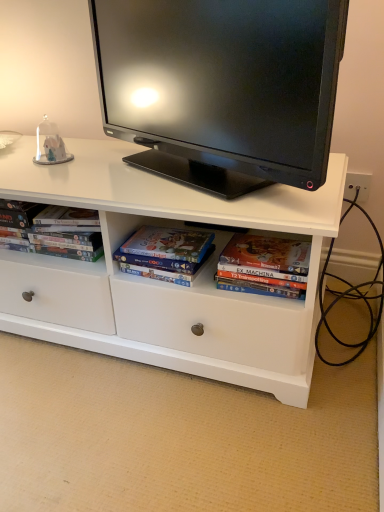
In order to click on matte black dvd case at left in this screenshot , I will do `click(51, 230)`.

The width and height of the screenshot is (384, 512). I want to click on black glossy tv at upper center, so click(x=222, y=88).

Locate an element on the screen. matte black dvd case at left is located at coordinates (51, 230).

From a real-world perspective, which object rests below the other?

matte cardboard book at center.

From the image's perspective, which one is positioned higher, matte black dvd case at left or matte cardboard book at center?

matte black dvd case at left is shown above in the image.

Which object is thinner, matte black dvd case at left or matte cardboard book at center?

Thinner between the two is matte black dvd case at left.

In the image, is matte black dvd case at left positioned in front of or behind matte cardboard book at center?

matte black dvd case at left is positioned farther from the viewer than matte cardboard book at center.

Measure the distance between black glossy tv at upper center and matte black dvd case at left.

black glossy tv at upper center is 14.86 inches from matte black dvd case at left.

Is black glossy tv at upper center placed right next to matte black dvd case at left?

No, black glossy tv at upper center is not making contact with matte black dvd case at left.

Considering the sizes of black glossy tv at upper center and matte black dvd case at left in the image, is black glossy tv at upper center taller or shorter than matte black dvd case at left?

Considering their sizes, black glossy tv at upper center has more height than matte black dvd case at left.

From a real-world perspective, which object stands above the other?

In real-world perspective, black glossy tv at upper center is above.

From the image's perspective, is matte cardboard book at center positioned above or below black glossy tv at upper center?

matte cardboard book at center is situated lower than black glossy tv at upper center in the image.

Does matte cardboard book at center have a lesser width compared to black glossy tv at upper center?

Indeed, matte cardboard book at center has a lesser width compared to black glossy tv at upper center.

Consider the image. Is matte cardboard book at center aimed at black glossy tv at upper center?

No, matte cardboard book at center is not facing towards black glossy tv at upper center.

Considering the sizes of objects black glossy tv at upper center and matte cardboard book at center in the image provided, who is smaller, black glossy tv at upper center or matte cardboard book at center?

Smaller between the two is matte cardboard book at center.

Is black glossy tv at upper center oriented away from matte cardboard book at center?

No, black glossy tv at upper center's orientation is not away from matte cardboard book at center.

What's the angular difference between black glossy tv at upper center and matte cardboard book at center's facing directions?

The angle between the facing direction of black glossy tv at upper center and the facing direction of matte cardboard book at center is 33.4 degrees.

From the image's perspective, which is below, black glossy tv at upper center or matte cardboard book at center?

matte cardboard book at center appears lower in the image.

Do you think matte black dvd case at left is within black glossy tv at upper center, or outside of it?

matte black dvd case at left is not inside black glossy tv at upper center, it's outside.

Find the location of a particular element. Image resolution: width=384 pixels, height=512 pixels. television lying above the matte black dvd case at left (from the image's perspective) is located at coordinates (222, 88).

Based on the photo, is matte black dvd case at left positioned far away from black glossy tv at upper center?

No, matte black dvd case at left is not far away from black glossy tv at upper center.

From the picture: Who is smaller, matte black dvd case at left or black glossy tv at upper center?

With smaller size is matte black dvd case at left.

From a real-world perspective, is matte cardboard book at center positioned over matte black dvd case at left based on gravity?

No, from a real-world perspective, matte cardboard book at center is not above matte black dvd case at left.

Considering their positions, is matte cardboard book at center located in front of or behind matte black dvd case at left?

In the image, matte cardboard book at center appears in front of matte black dvd case at left.

Where is `book above the matte cardboard book at center (from a real-world perspective)`? This screenshot has width=384, height=512. book above the matte cardboard book at center (from a real-world perspective) is located at coordinates (51, 230).

This screenshot has width=384, height=512. In order to click on television on the right side of matte black dvd case at left in this screenshot , I will do `click(222, 88)`.

From the image, which object appears to be farther from black glossy tv at upper center, matte black dvd case at left or matte cardboard book at center?

matte cardboard book at center is further to black glossy tv at upper center.

Considering their positions, is black glossy tv at upper center positioned closer to matte black dvd case at left than matte cardboard book at center?

matte cardboard book at center.

Looking at the image, which one is located closer to matte black dvd case at left, matte cardboard book at center or black glossy tv at upper center?

Based on the image, matte cardboard book at center appears to be nearer to matte black dvd case at left.

Looking at the image, which one is located closer to matte cardboard book at center, black glossy tv at upper center or matte black dvd case at left?

matte black dvd case at left.

From the image, which object appears to be farther from matte cardboard book at center, matte black dvd case at left or black glossy tv at upper center?

black glossy tv at upper center.

Consider the image. Based on their spatial positions, is matte cardboard book at center or matte black dvd case at left further from black glossy tv at upper center?

matte cardboard book at center lies further to black glossy tv at upper center than the other object.

At what (x,y) coordinates should I click in order to perform the action: click on paperback book positioned between black glossy tv at upper center and matte black dvd case at left from near to far. Please return your answer as a coordinate pair (x, y). The width and height of the screenshot is (384, 512). Looking at the image, I should click on (161, 267).